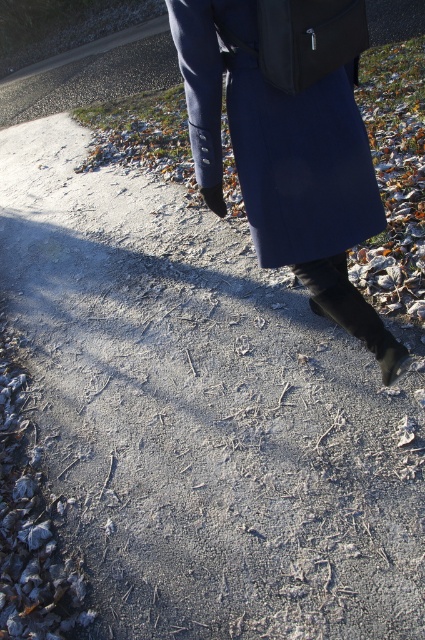
Question: Which point is farther to the camera?

Choices:
 (A) (263, 72)
 (B) (362, 296)

Answer: (B)

Question: Does navy wool coat at center appear on the left side of matte black bag at center?

Choices:
 (A) no
 (B) yes

Answer: (B)

Question: Among these objects, which one is farthest from the camera?

Choices:
 (A) matte black bag at center
 (B) navy wool coat at center

Answer: (B)

Question: Which object appears farthest from the camera in this image?

Choices:
 (A) black suede boot at lower center
 (B) matte black bag at center
 (C) navy wool coat at center

Answer: (A)

Question: Can you confirm if navy wool coat at center is thinner than black suede boot at lower center?

Choices:
 (A) no
 (B) yes

Answer: (A)

Question: Does navy wool coat at center appear under matte black bag at center?

Choices:
 (A) yes
 (B) no

Answer: (A)